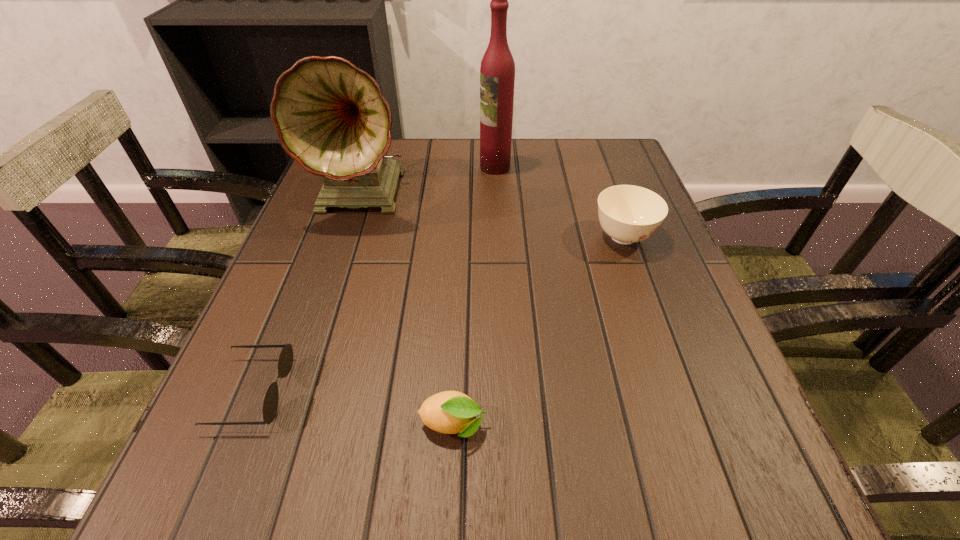
Image resolution: width=960 pixels, height=540 pixels. In order to click on free space at the near edge of the desktop in this screenshot , I will do `click(330, 478)`.

The width and height of the screenshot is (960, 540). In the image, there is a desktop. Identify the location of vacant space at the left edge. (276, 302).

Locate an element on the screen. This screenshot has width=960, height=540. vacant region at the right edge is located at coordinates (650, 275).

I want to click on free space at the near left corner, so click(x=191, y=524).

Locate an element on the screen. This screenshot has width=960, height=540. blank space at the far right corner of the desktop is located at coordinates (624, 166).

Identify the location of vacant space at the near right corner of the desktop. (789, 494).

Locate an element on the screen. vacant space in between the fourth tallest object and the liquor is located at coordinates (474, 296).

The width and height of the screenshot is (960, 540). I want to click on free space between the third tallest object and the liquor, so click(559, 202).

Locate an element on the screen. This screenshot has width=960, height=540. free space between the liquor and the lemon is located at coordinates click(x=474, y=296).

You are a GUI agent. You are given a task and a screenshot of the screen. Output one action in this format:
    pyautogui.click(x=<x>, y=<y>)
    Task: Click on the empty space between the third shortest object and the liquor
    
    Given the screenshot: What is the action you would take?
    pyautogui.click(x=559, y=202)